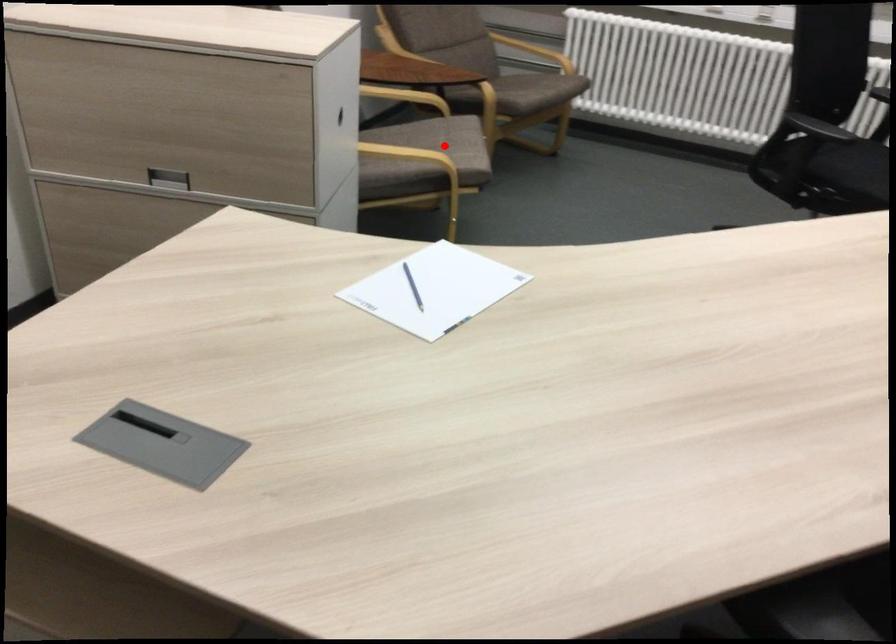
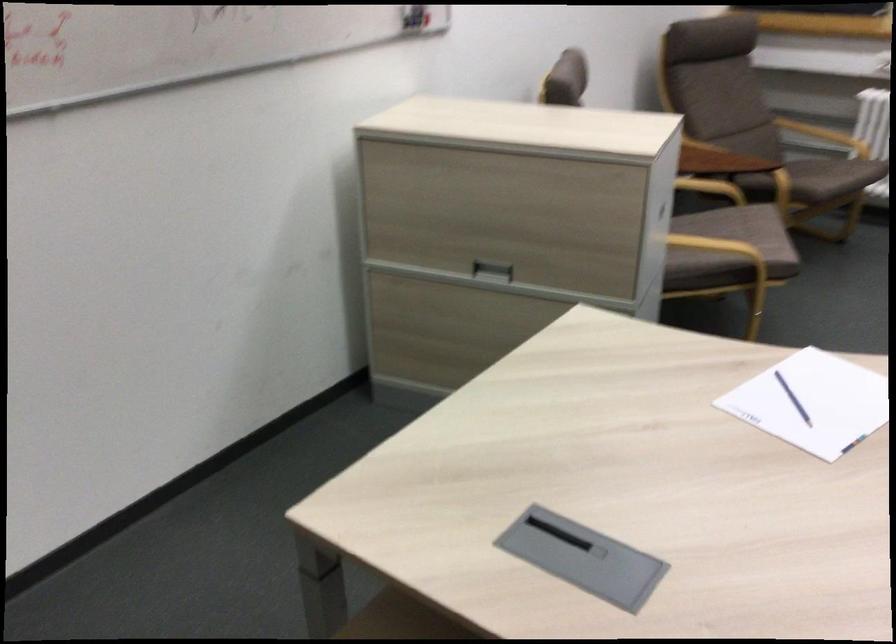
The point at the highlighted location is marked in the first image. Where is the corresponding point in the second image?

(746, 232)